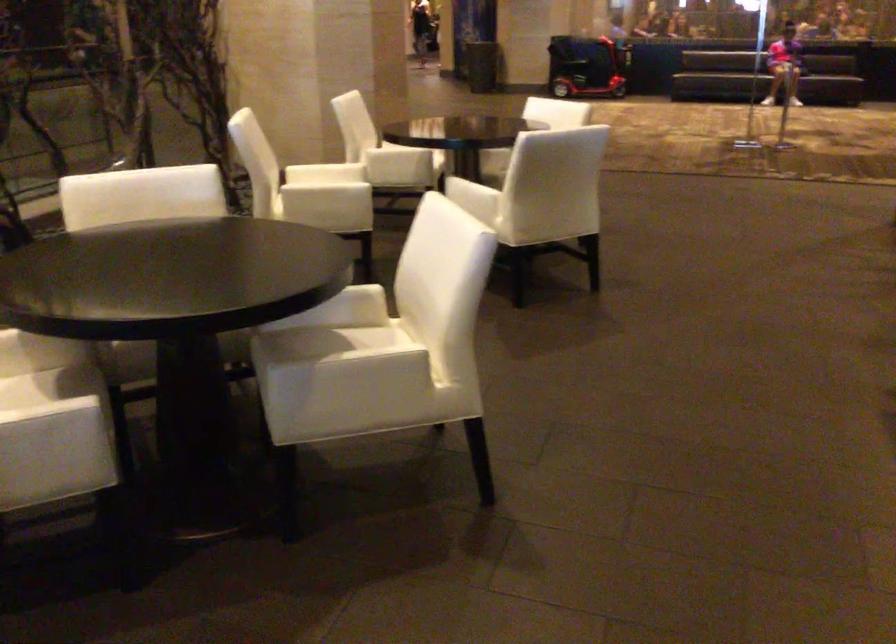
What do you see at coordinates (763, 79) in the screenshot?
I see `a sofa sitting surface` at bounding box center [763, 79].